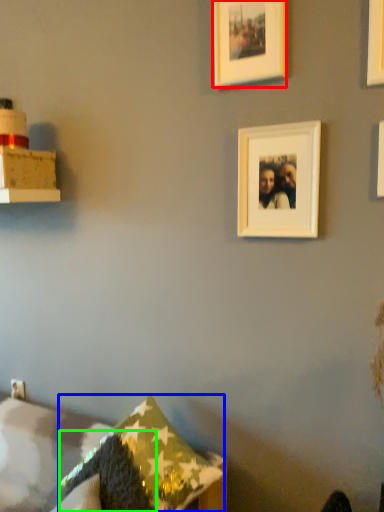
Question: Based on their relative distances, which object is farther from picture frame (highlighted by a red box)? Choose from pillow (highlighted by a blue box) and pillow (highlighted by a green box).

Choices:
 (A) pillow
 (B) pillow

Answer: (B)